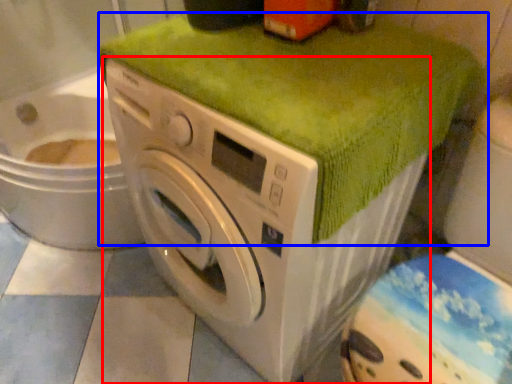
Question: Which point is closer to the camera, washing machine (highlighted by a red box) or bath towel (highlighted by a blue box)?

Choices:
 (A) washing machine
 (B) bath towel

Answer: (A)